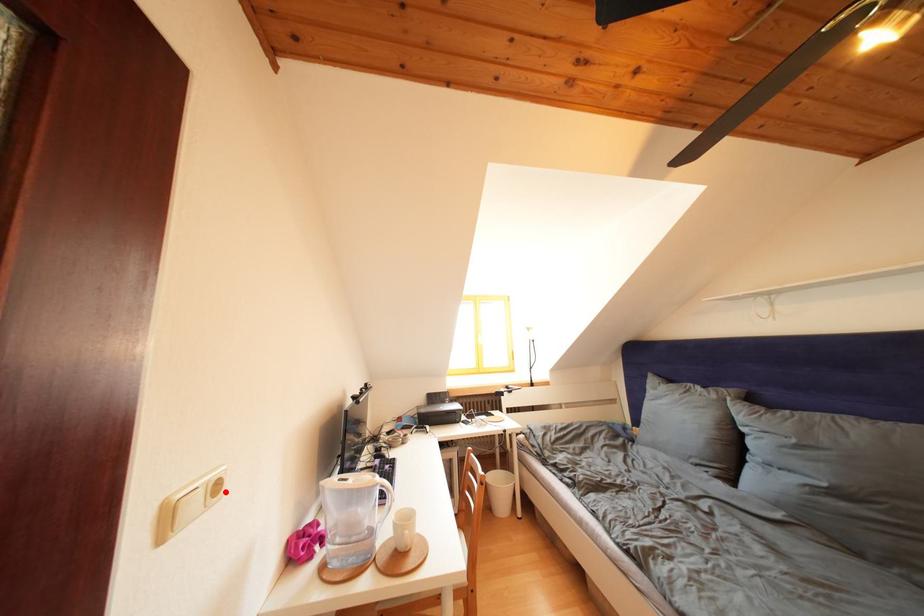
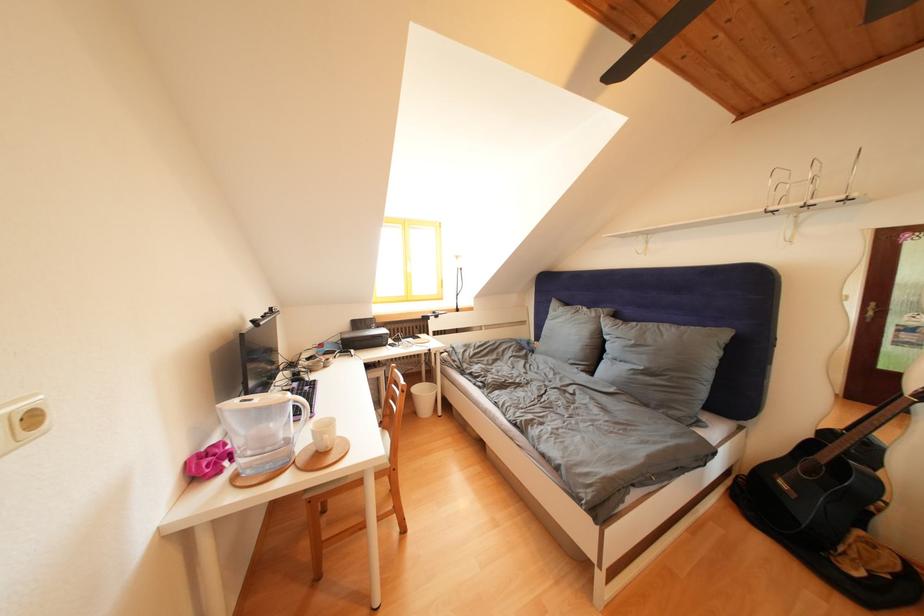
Locate, in the second image, the point that corresponds to the highlighted location in the first image.

(41, 424)